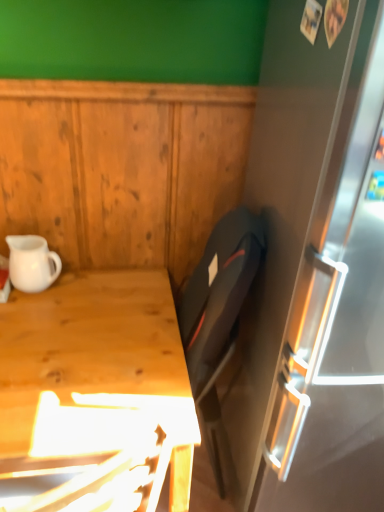
Locate an element on the screen. The height and width of the screenshot is (512, 384). free location in front of white matte pitcher at left is located at coordinates (36, 310).